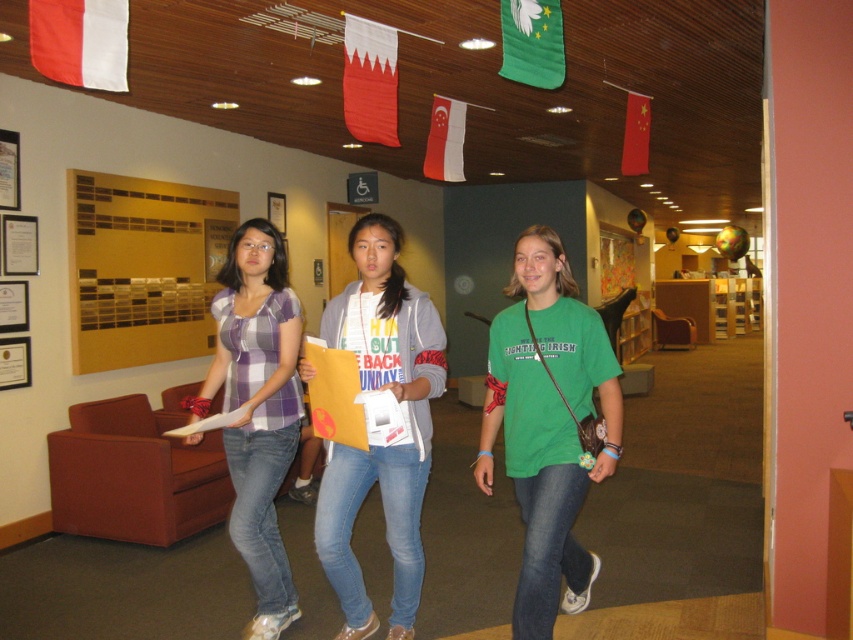
Who is positioned more to the left, green matte t-shirt at center or plaid fabric shirt at center?

plaid fabric shirt at center

Is green matte t-shirt at center bigger than plaid fabric shirt at center?

Correct, green matte t-shirt at center is larger in size than plaid fabric shirt at center.

I want to click on green matte t-shirt at center, so click(x=548, y=424).

Is point (416, 360) less distant than point (99, 340)?

Yes, it is in front of point (99, 340).

Is denim jeans at center above gold metallic bulletin board at upper left?

No, denim jeans at center is not above gold metallic bulletin board at upper left.

Image resolution: width=853 pixels, height=640 pixels. Identify the location of denim jeans at center. (383, 440).

Where is `denim jeans at center`? denim jeans at center is located at coordinates (383, 440).

Can you confirm if gold metallic bulletin board at upper left is shorter than plaid fabric shirt at center?

Correct, gold metallic bulletin board at upper left is not as tall as plaid fabric shirt at center.

Is gold metallic bulletin board at upper left positioned before plaid fabric shirt at center?

No.

Is point (111, 284) more distant than point (270, 582)?

Yes, it is behind point (270, 582).

Image resolution: width=853 pixels, height=640 pixels. What are the coordinates of `gold metallic bulletin board at upper left` in the screenshot? It's located at (143, 268).